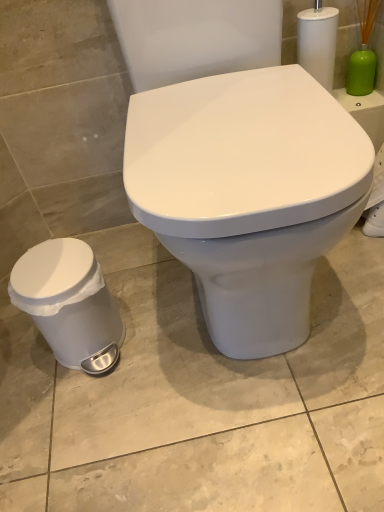
Question: Based on their sizes in the image, would you say white plastic trash can at lower left is bigger or smaller than white glossy toilet at center?

Choices:
 (A) big
 (B) small

Answer: (B)

Question: Considering the positions of white plastic trash can at lower left and white glossy toilet at center in the image, is white plastic trash can at lower left taller or shorter than white glossy toilet at center?

Choices:
 (A) tall
 (B) short

Answer: (B)

Question: Estimate the real-world distances between objects in this image. Which object is closer to the green matte brush at upper right?

Choices:
 (A) white plastic trash can at lower left
 (B) white glossy toilet at center

Answer: (B)

Question: Which of these objects is positioned closest to the white glossy toilet at center?

Choices:
 (A) white plastic trash can at lower left
 (B) green matte brush at upper right

Answer: (A)